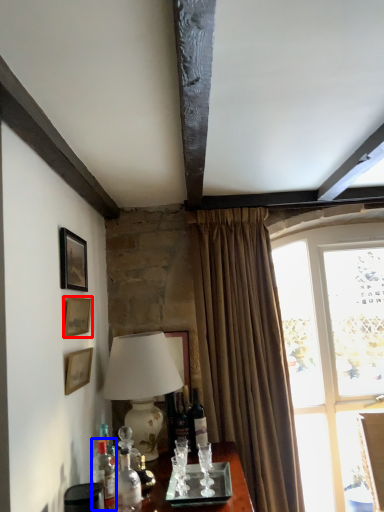
Question: Which object appears farthest to the camera in this image, picture frame (highlighted by a red box) or bottle (highlighted by a blue box)?

Choices:
 (A) picture frame
 (B) bottle

Answer: (A)